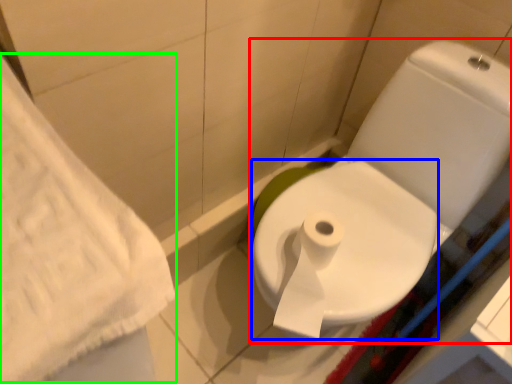
Question: Which object is the closest to the toilet (highlighted by a red box)? Choose among these: bidet (highlighted by a blue box) or bath towel (highlighted by a green box).

Choices:
 (A) bidet
 (B) bath towel

Answer: (A)